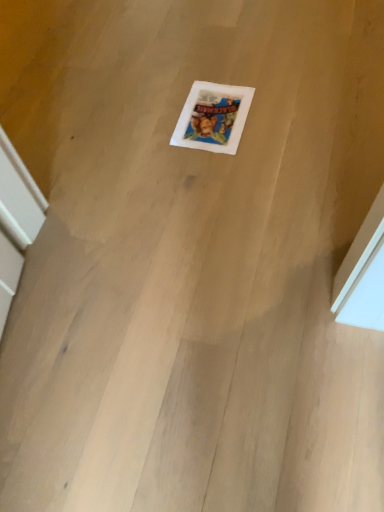
Where is `white matte picture frame at center`? white matte picture frame at center is located at coordinates (213, 117).

What is the approximate width of white matte picture frame at center?

The width of white matte picture frame at center is 30.41 centimeters.

The width and height of the screenshot is (384, 512). What do you see at coordinates (213, 117) in the screenshot? I see `white matte picture frame at center` at bounding box center [213, 117].

At what (x,y) coordinates should I click in order to perform the action: click on white matte picture frame at center. Please return your answer as a coordinate pair (x, y). The image size is (384, 512). Looking at the image, I should click on (213, 117).